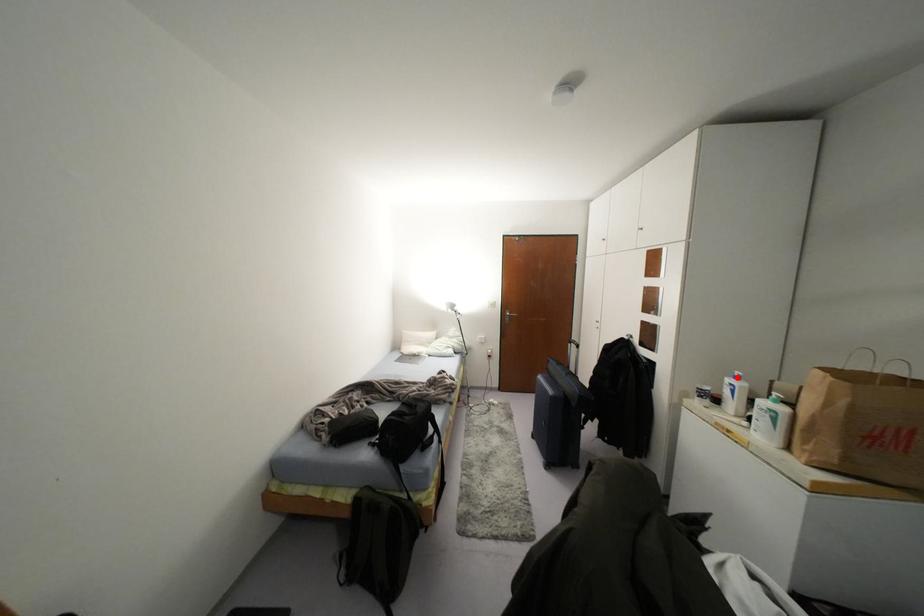
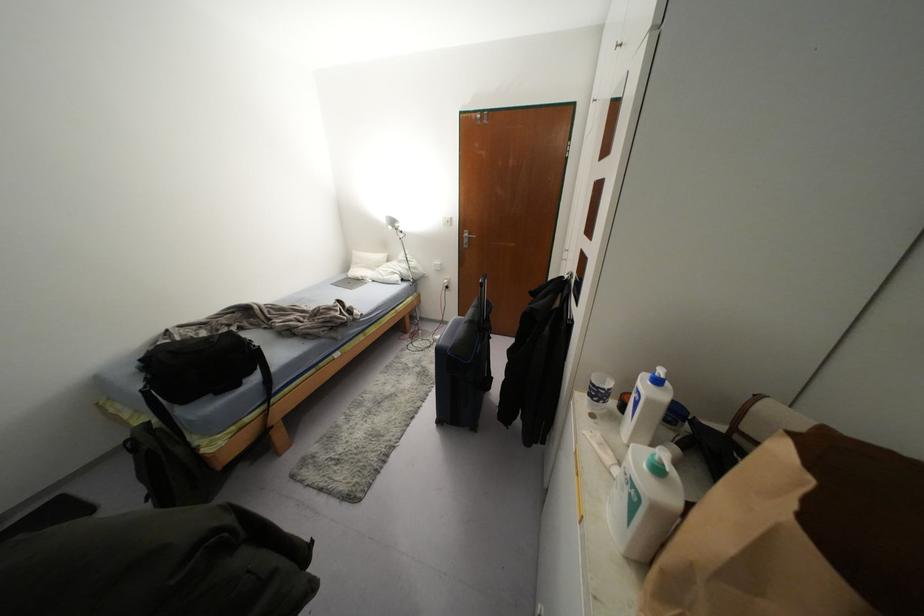
Locate, in the second image, the point that corresponds to the highlighted location in the first image.

(658, 381)